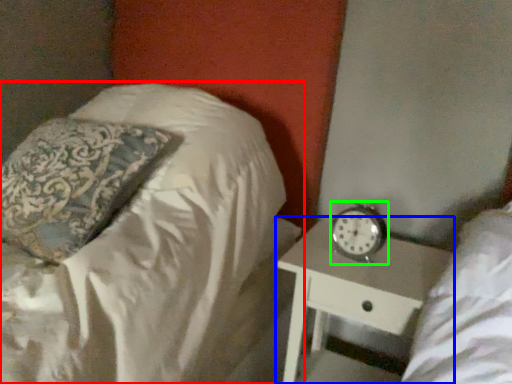
Question: Estimate the real-world distances between objects in this image. Which object is farther from bed (highlighted by a red box), nightstand (highlighted by a blue box) or clock (highlighted by a green box)?

Choices:
 (A) nightstand
 (B) clock

Answer: (B)